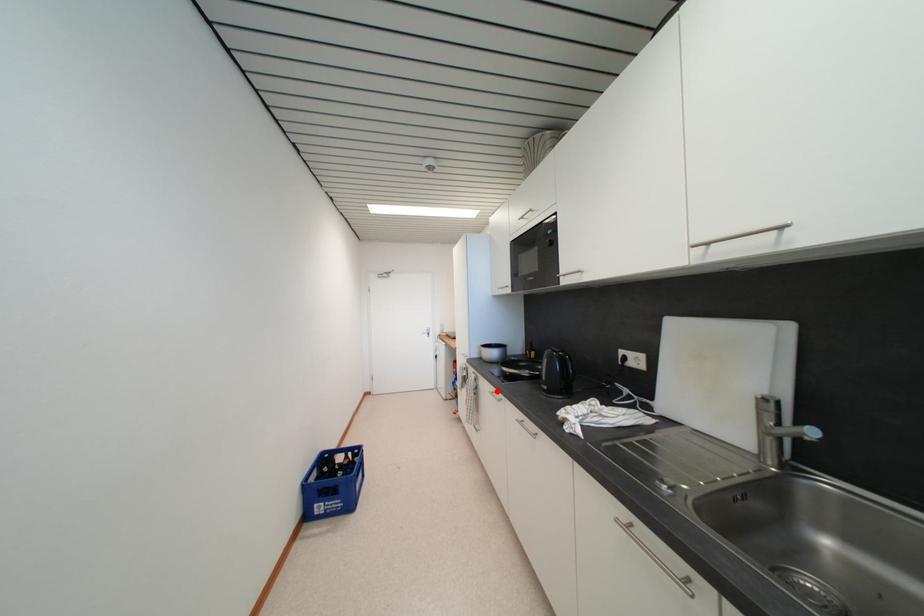
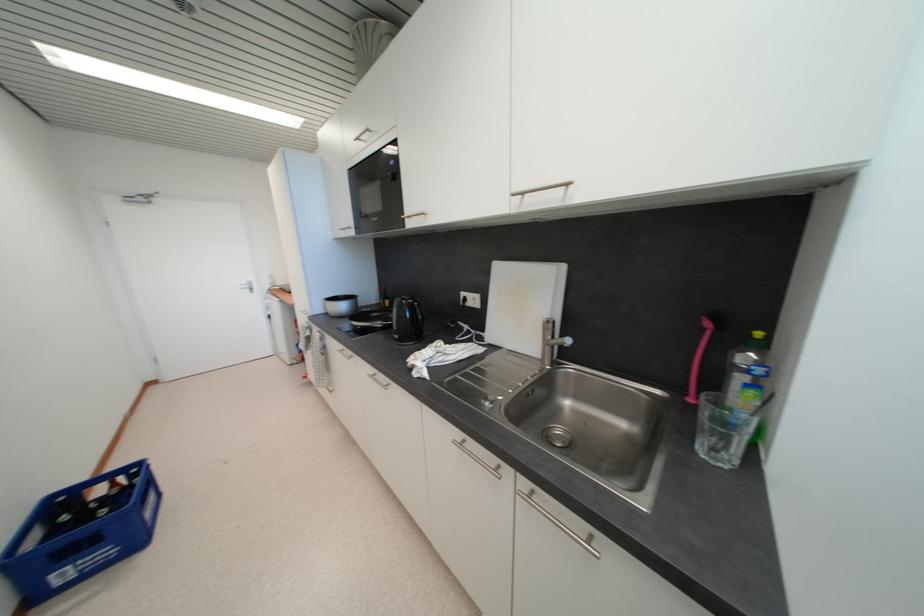
The point at the highlighted location is marked in the first image. Where is the corresponding point in the second image?

(346, 349)